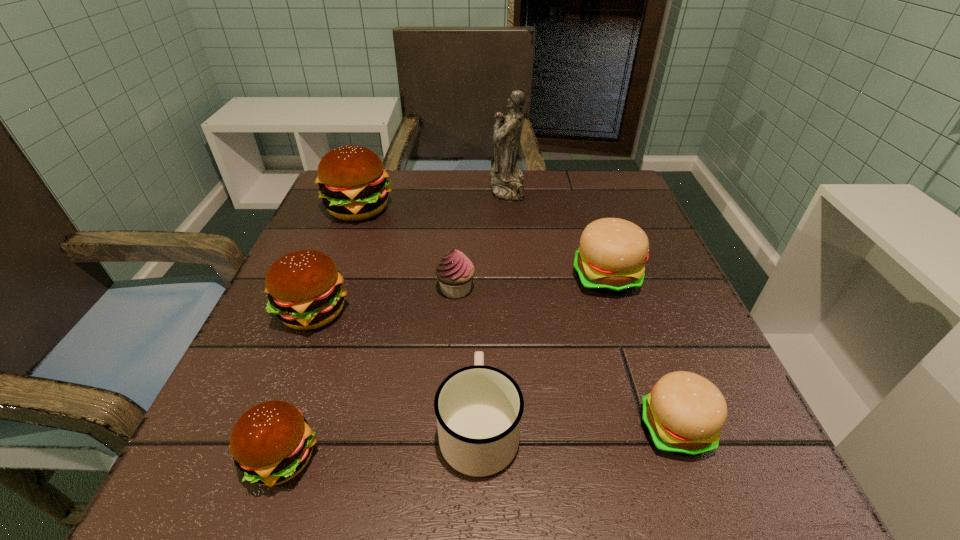
The width and height of the screenshot is (960, 540). Find the location of `vacant area situated on the front-facing side of the figurine`. vacant area situated on the front-facing side of the figurine is located at coordinates (450, 188).

Locate an element on the screen. Image resolution: width=960 pixels, height=540 pixels. free space located on the front-facing side of the figurine is located at coordinates (395, 188).

You are a GUI agent. You are given a task and a screenshot of the screen. Output one action in this format:
    pyautogui.click(x=<x>, y=<y>)
    Task: Click on the free space located on the front of the farthest hamburger
    Image resolution: width=960 pixels, height=540 pixels.
    Given the screenshot: What is the action you would take?
    pyautogui.click(x=333, y=276)

Find the location of a particular element. This screenshot has height=540, width=960. vacant space located 0.170m on the front of the second smallest brown hamburger is located at coordinates (265, 433).

The image size is (960, 540). Find the location of `vacant space located on the back of the farther beige hamburger`. vacant space located on the back of the farther beige hamburger is located at coordinates (572, 173).

The width and height of the screenshot is (960, 540). Find the location of `free space located on the back of the pink cupcake`. free space located on the back of the pink cupcake is located at coordinates (462, 197).

Where is `vacant space located on the side of the mug with the handle`? vacant space located on the side of the mug with the handle is located at coordinates (479, 234).

This screenshot has height=540, width=960. In order to click on free point located on the side of the mug with the handle in this screenshot , I will do `click(479, 283)`.

In order to click on blank space located 0.210m on the side of the mug with the handle in this screenshot , I will do `click(479, 290)`.

This screenshot has height=540, width=960. In order to click on vacant area situated on the right of the nearest brown hamburger in this screenshot , I will do `click(486, 458)`.